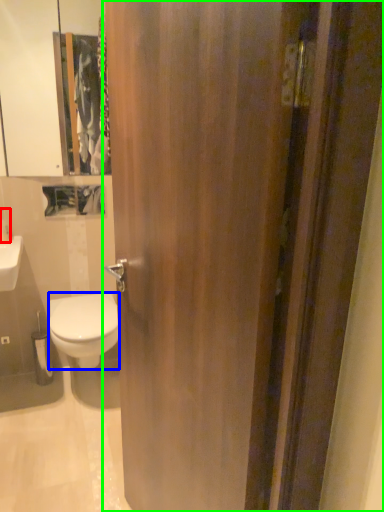
Question: Which object is positioned farthest from toiletry (highlighted by a red box)? Select from bidet (highlighted by a blue box) and door (highlighted by a green box).

Choices:
 (A) bidet
 (B) door

Answer: (B)